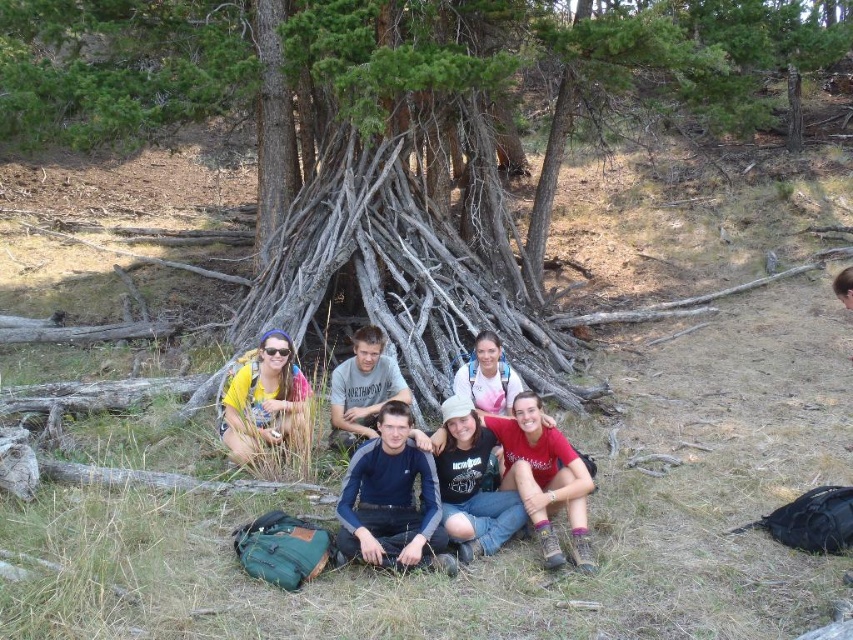
Question: Among these objects, which one is farthest from the camera?

Choices:
 (A) yellow fabric at lower left
 (B) dark blue sweater at center
 (C) dark blue fleece at center
 (D) black cotton shirt at center

Answer: (B)

Question: Considering the relative positions of dark blue fleece at center and dark blue sweater at center in the image provided, where is dark blue fleece at center located with respect to dark blue sweater at center?

Choices:
 (A) above
 (B) below

Answer: (B)

Question: Does yellow fabric at lower left have a lesser width compared to dark blue sweater at center?

Choices:
 (A) no
 (B) yes

Answer: (A)

Question: Estimate the real-world distances between objects in this image. Which object is closer to the yellow fabric at lower left?

Choices:
 (A) dark blue sweater at center
 (B) pink fabric shirt at center
 (C) dark blue fleece at center
 (D) black cotton shirt at center

Answer: (A)

Question: Is black cotton shirt at center smaller than yellow fabric at lower left?

Choices:
 (A) yes
 (B) no

Answer: (A)

Question: Which point appears closest to the camera in this image?

Choices:
 (A) (480, 349)
 (B) (239, 401)

Answer: (B)